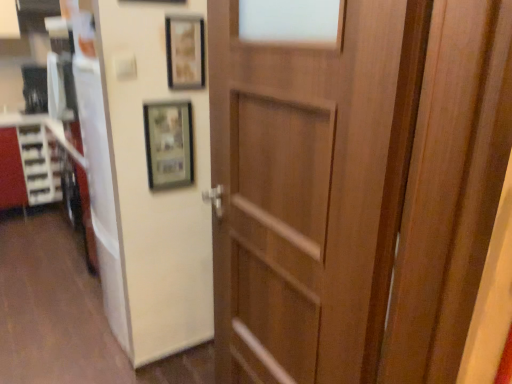
Question: Is matte white cabinet at left far away from matte wooden picture frame at upper center, which is the 2th picture frame from top to bottom?

Choices:
 (A) yes
 (B) no

Answer: (A)

Question: Does matte white cabinet at left contain matte wooden picture frame at upper center, which is the 2th picture frame from top to bottom?

Choices:
 (A) yes
 (B) no

Answer: (B)

Question: Is matte white cabinet at left positioned beyond the bounds of matte wooden picture frame at upper center, the 1th picture frame positioned from the bottom?

Choices:
 (A) no
 (B) yes

Answer: (B)

Question: Does matte white cabinet at left have a larger size compared to matte wooden picture frame at upper center, which is the 2th picture frame from top to bottom?

Choices:
 (A) no
 (B) yes

Answer: (B)

Question: From the image's perspective, is matte white cabinet at left below matte wooden picture frame at upper center, which is the 2th picture frame from top to bottom?

Choices:
 (A) no
 (B) yes

Answer: (A)

Question: Is point (152, 157) closer or farther from the camera than point (13, 139)?

Choices:
 (A) closer
 (B) farther

Answer: (A)

Question: From a real-world perspective, is matte wooden picture frame at upper center, the 1th picture frame positioned from the bottom, above or below matte white cabinet at left?

Choices:
 (A) below
 (B) above

Answer: (B)

Question: Based on their sizes in the image, would you say matte wooden picture frame at upper center, the 1th picture frame positioned from the bottom, is bigger or smaller than matte white cabinet at left?

Choices:
 (A) small
 (B) big

Answer: (A)

Question: Is matte wooden picture frame at upper center, the 1th picture frame positioned from the bottom, inside the boundaries of matte white cabinet at left, or outside?

Choices:
 (A) inside
 (B) outside

Answer: (B)

Question: Considering their positions, is wooden frame at upper center, positioned as the second picture frame in bottom-to-top order, located in front of or behind wooden door at center?

Choices:
 (A) front
 (B) behind

Answer: (B)

Question: Is wooden frame at upper center, which appears as the first picture frame when viewed from the top, taller or shorter than wooden door at center?

Choices:
 (A) tall
 (B) short

Answer: (B)

Question: Considering the positions of wooden frame at upper center, which appears as the first picture frame when viewed from the top, and wooden door at center in the image, is wooden frame at upper center, which appears as the first picture frame when viewed from the top, wider or thinner than wooden door at center?

Choices:
 (A) thin
 (B) wide

Answer: (A)

Question: From the image's perspective, is wooden frame at upper center, which appears as the first picture frame when viewed from the top, positioned above or below wooden door at center?

Choices:
 (A) above
 (B) below

Answer: (A)

Question: Based on their sizes in the image, would you say matte white cabinet at left is bigger or smaller than wooden frame at upper center, positioned as the second picture frame in bottom-to-top order?

Choices:
 (A) big
 (B) small

Answer: (A)

Question: From a real-world perspective, is matte white cabinet at left physically located above or below wooden frame at upper center, which appears as the first picture frame when viewed from the top?

Choices:
 (A) above
 (B) below

Answer: (B)